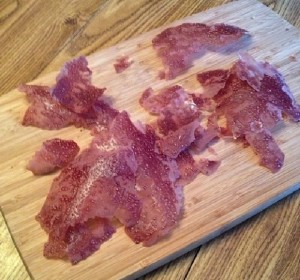
Image resolution: width=300 pixels, height=280 pixels. I want to click on oil on cutting board, so click(x=217, y=213), click(x=193, y=203).